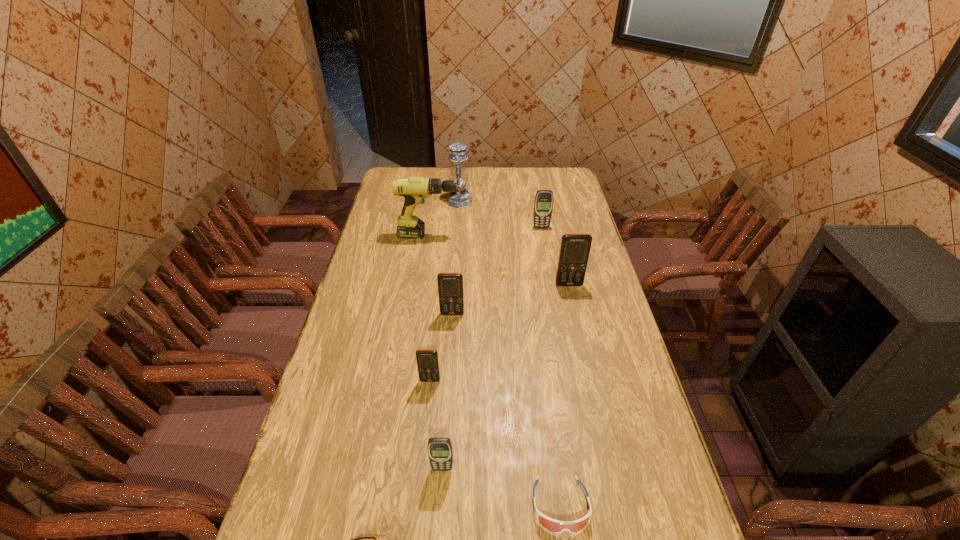
This screenshot has width=960, height=540. Identify the location of lantern. (461, 197).

Find the location of a particular element. The height and width of the screenshot is (540, 960). the seventh nearest object is located at coordinates (414, 189).

The width and height of the screenshot is (960, 540). Find the location of `the farthest orange cellular telephone`. the farthest orange cellular telephone is located at coordinates (574, 251).

The height and width of the screenshot is (540, 960). I want to click on the rightmost orange cellular telephone, so click(574, 251).

Locate an element on the screen. The height and width of the screenshot is (540, 960). the right gray cellular telephone is located at coordinates (543, 205).

In order to click on the eighth nearest object in this screenshot , I will do `click(543, 205)`.

You are a GUI agent. You are given a task and a screenshot of the screen. Output one action in this format:
    pyautogui.click(x=<x>, y=<y>)
    Task: Click on the fifth nearest object
    Image resolution: width=960 pixels, height=540 pixels.
    Given the screenshot: What is the action you would take?
    pyautogui.click(x=450, y=285)

Find the location of a particular element. This screenshot has width=960, height=540. the third farthest cellular telephone is located at coordinates (450, 285).

In order to click on the fourth nearest object in this screenshot , I will do `click(427, 359)`.

Locate an element on the screen. The width and height of the screenshot is (960, 540). the nearest orange cellular telephone is located at coordinates (427, 359).